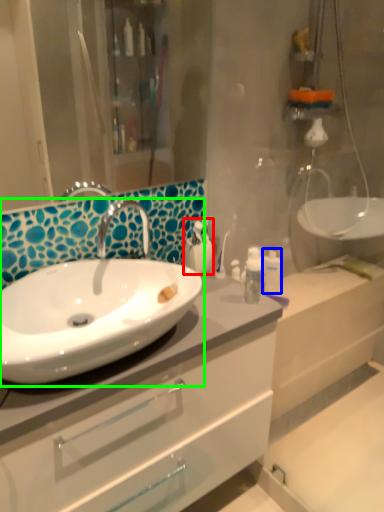
Question: Based on their relative distances, which object is nearer to toiletry (highlighted by a red box)? Choose from toiletry (highlighted by a blue box) and sink (highlighted by a green box).

Choices:
 (A) toiletry
 (B) sink

Answer: (A)